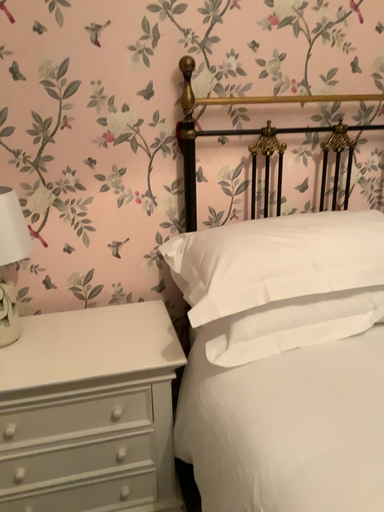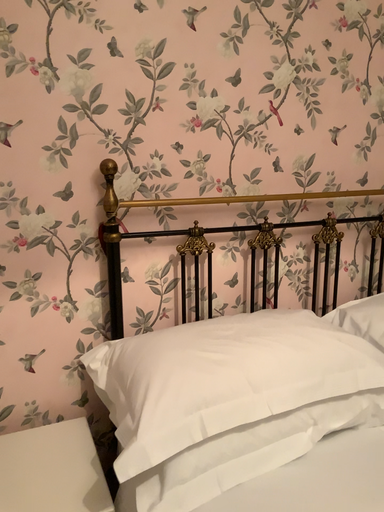
Question: How did the camera likely rotate when shooting the video?

Choices:
 (A) rotated upward
 (B) rotated downward

Answer: (A)